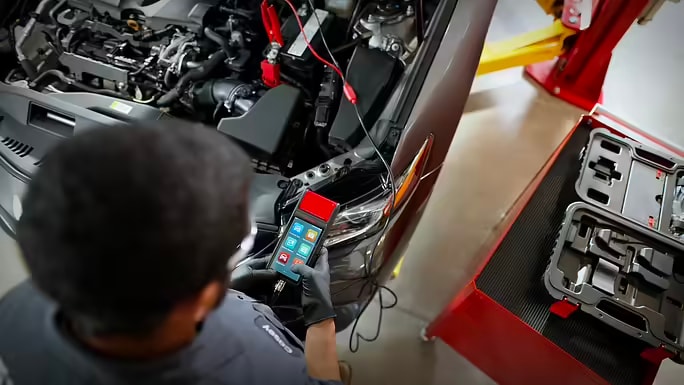
Locate an element on the screen. The width and height of the screenshot is (684, 385). cables is located at coordinates click(275, 33).